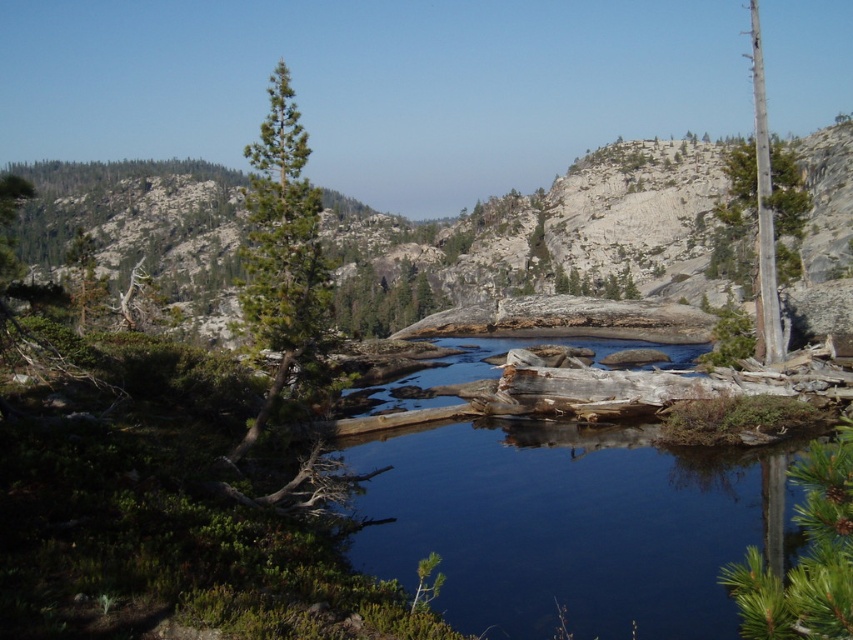
Is rocky terrain at center to the right of green textured tree at center from the viewer's perspective?

In fact, rocky terrain at center is to the left of green textured tree at center.

Who is positioned more to the left, rocky terrain at center or green textured tree at center?

Answer: rocky terrain at center

Describe the element at coordinates (563, 230) in the screenshot. I see `rocky terrain at center` at that location.

Locate an element on the screen. Image resolution: width=853 pixels, height=640 pixels. rocky terrain at center is located at coordinates (563, 230).

Does point (294, 196) come behind point (732, 580)?

That is True.

From the picture: Which is more to the left, green needle-like tree at center-left or green matte tree at lower right?

green needle-like tree at center-left is more to the left.

Does point (296, 180) come in front of point (831, 476)?

No, it is not.

Identify the location of green needle-like tree at center-left. (282, 252).

Between green needle-like tree at center-left and green textured tree at center, which one is positioned higher?

green needle-like tree at center-left is higher up.

Looking at this image, does green needle-like tree at center-left have a smaller size compared to green textured tree at center?

No, green needle-like tree at center-left is not smaller than green textured tree at center.

Which is behind, point (302, 157) or point (419, 307)?

The point (419, 307) is more distant.

This screenshot has width=853, height=640. I want to click on green needle-like tree at center-left, so click(x=282, y=252).